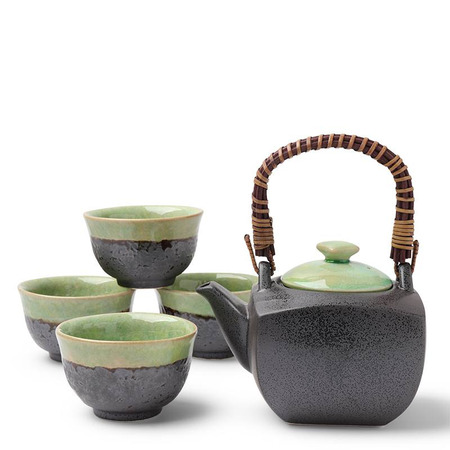
Where is `black kettle`? black kettle is located at coordinates (330, 361).